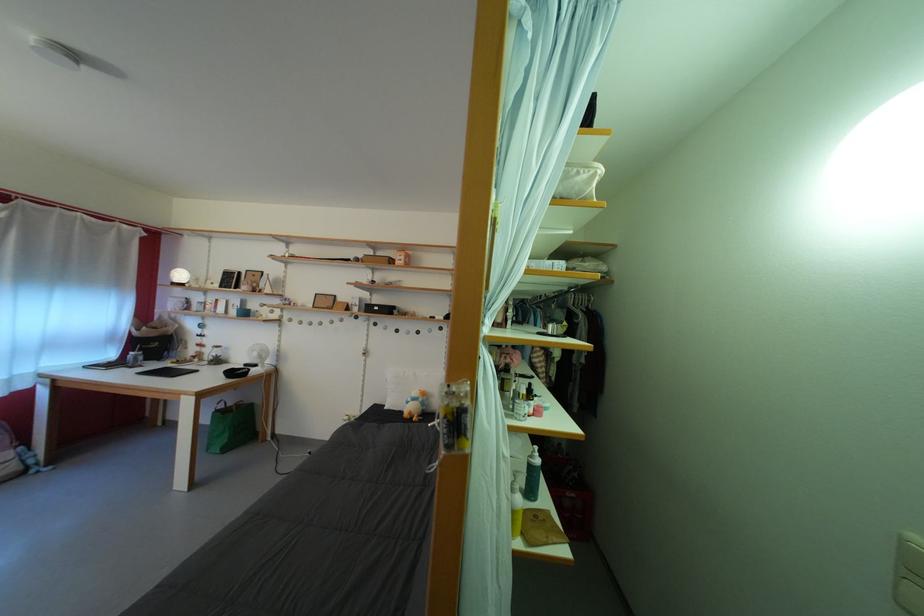
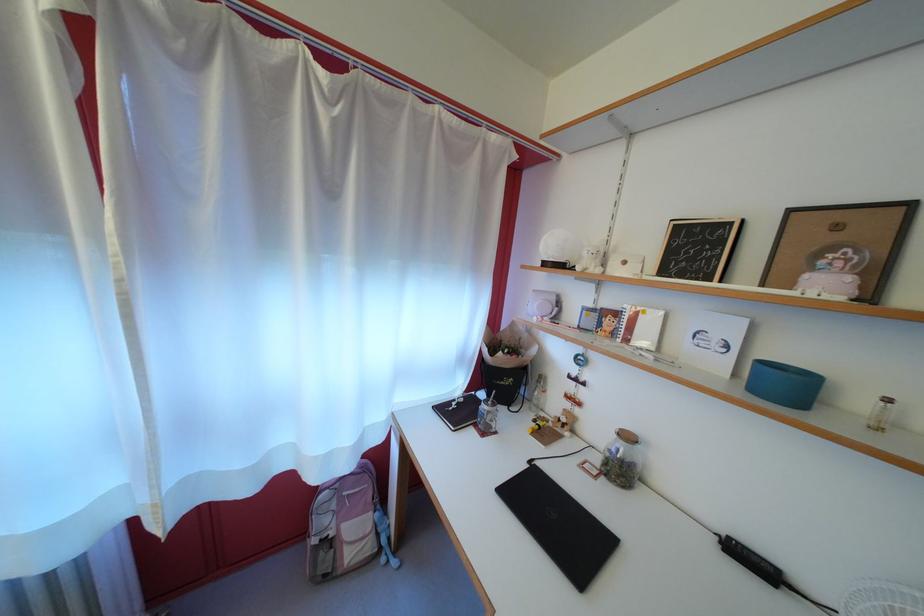
In the second image, find the point that corresponds to (x=226, y=353) in the first image.

(637, 444)